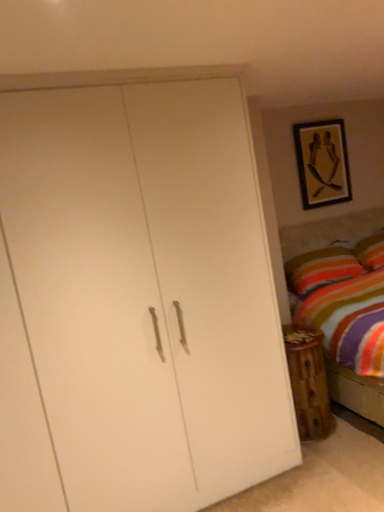
The image size is (384, 512). Describe the element at coordinates (322, 163) in the screenshot. I see `matte black picture frame at upper right` at that location.

Where is `matte black picture frame at upper right`? The image size is (384, 512). matte black picture frame at upper right is located at coordinates (322, 163).

Where is `matte black picture frame at upper right`? Image resolution: width=384 pixels, height=512 pixels. matte black picture frame at upper right is located at coordinates (322, 163).